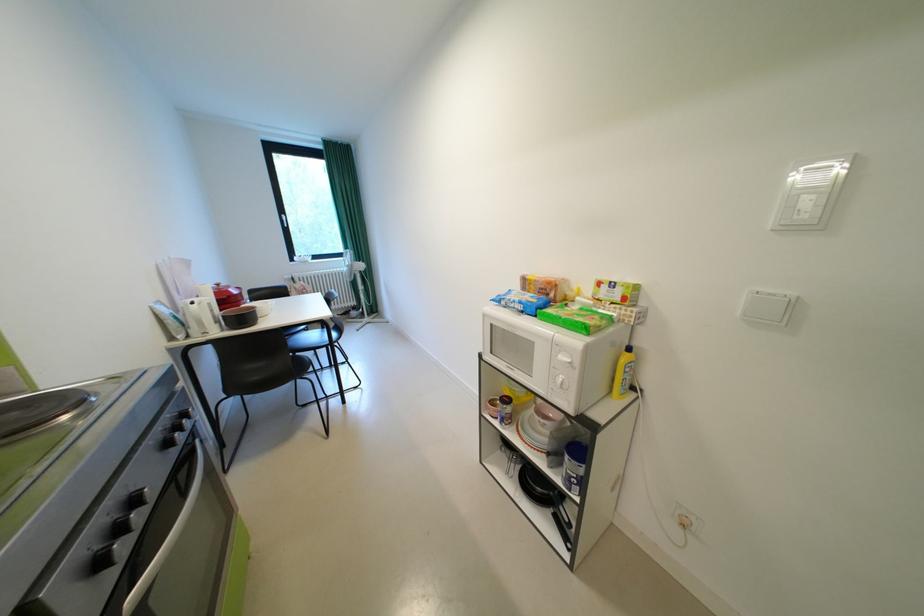
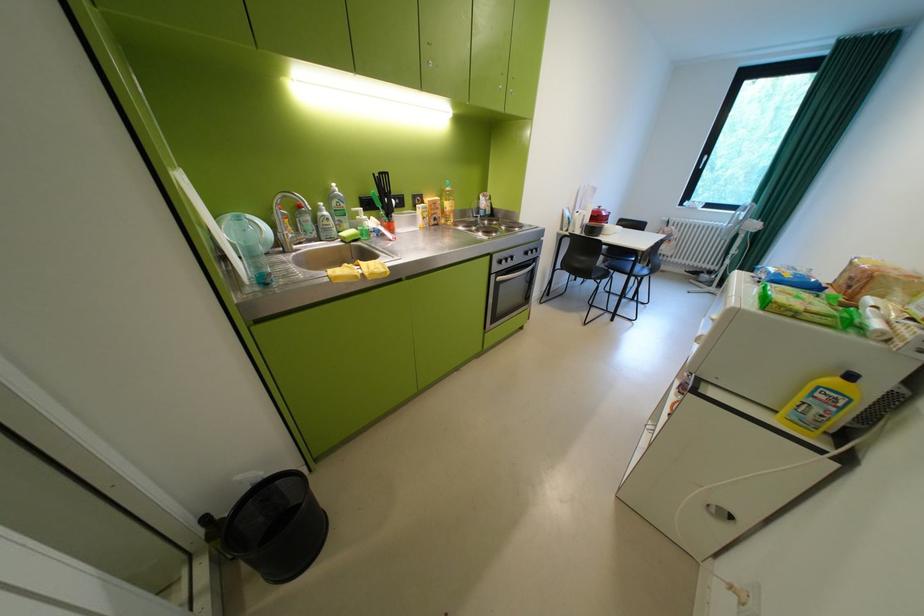
Locate, in the second image, the point that corresponds to the point at 268,378 in the first image.

(587, 265)